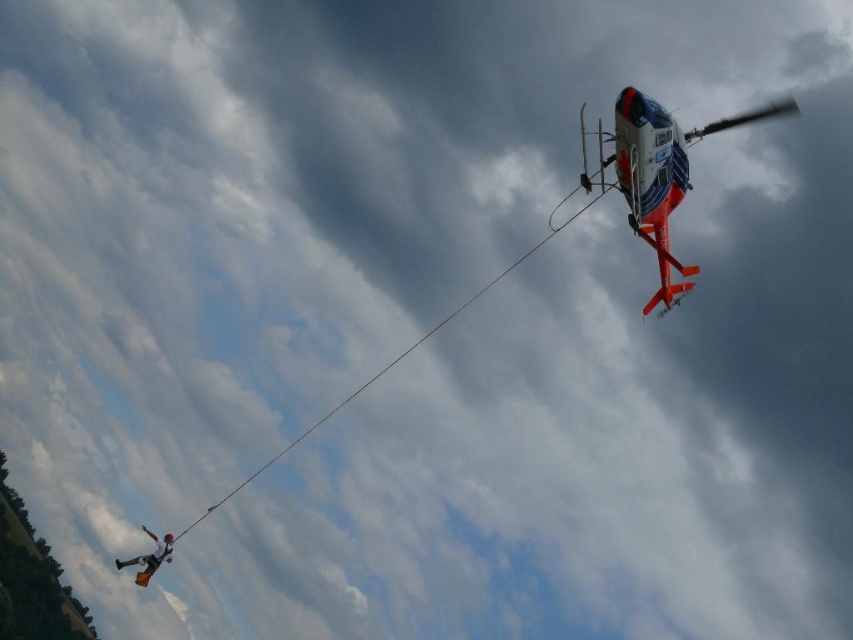
You are a pilot in a helicopter. You see a point at coordinates (657, 172) in your radar. What object does this point correspond to?

The orange metallic helicopter at upper right is represented by point (657, 172).